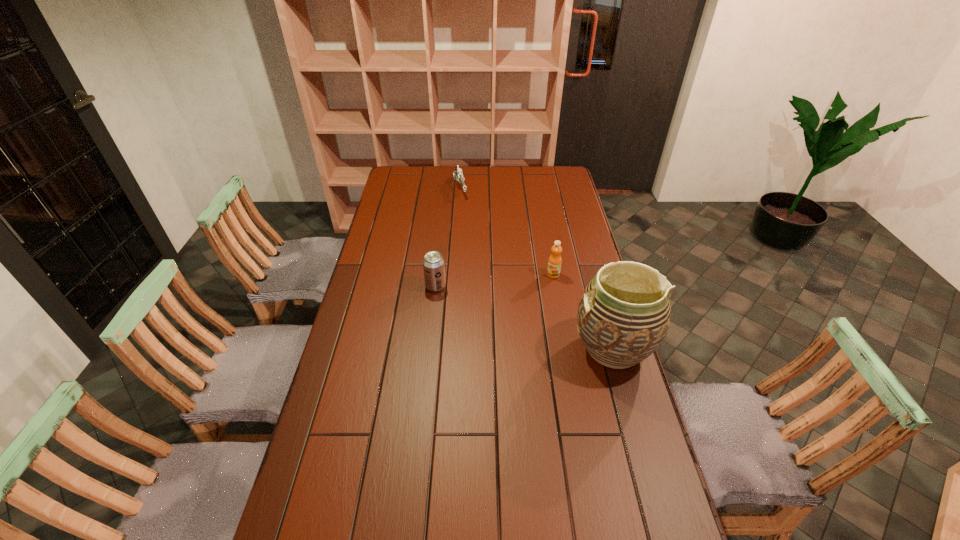
The width and height of the screenshot is (960, 540). What are the coordinates of `the third farthest object` in the screenshot? It's located at (433, 263).

Locate an element on the screen. the tallest object is located at coordinates (623, 316).

At what (x,y) coordinates should I click in order to perform the action: click on the nearest object. Please return your answer as a coordinate pair (x, y). Looking at the image, I should click on (623, 316).

Identify the location of orange juice. Image resolution: width=960 pixels, height=540 pixels. (554, 263).

The width and height of the screenshot is (960, 540). I want to click on gun, so click(457, 175).

Where is `the shortest object`? the shortest object is located at coordinates [x=457, y=175].

Locate an element on the screen. free spot located 0.380m on the back of the beer can is located at coordinates (443, 222).

This screenshot has height=540, width=960. In order to click on vacant space located 0.170m on the back of the tallest object in this screenshot , I will do `click(595, 285)`.

You are a GUI agent. You are given a task and a screenshot of the screen. Output one action in this format:
    pyautogui.click(x=<x>, y=<y>)
    Task: Click on the vacant space situated 0.320m on the front label of the third nearest object
    
    Given the screenshot: What is the action you would take?
    pyautogui.click(x=499, y=326)

At what (x,y) coordinates should I click in order to perform the action: click on vacant position located 0.250m on the front label of the third nearest object. Please return your answer as a coordinate pair (x, y). The image size is (960, 540). Looking at the image, I should click on (512, 314).